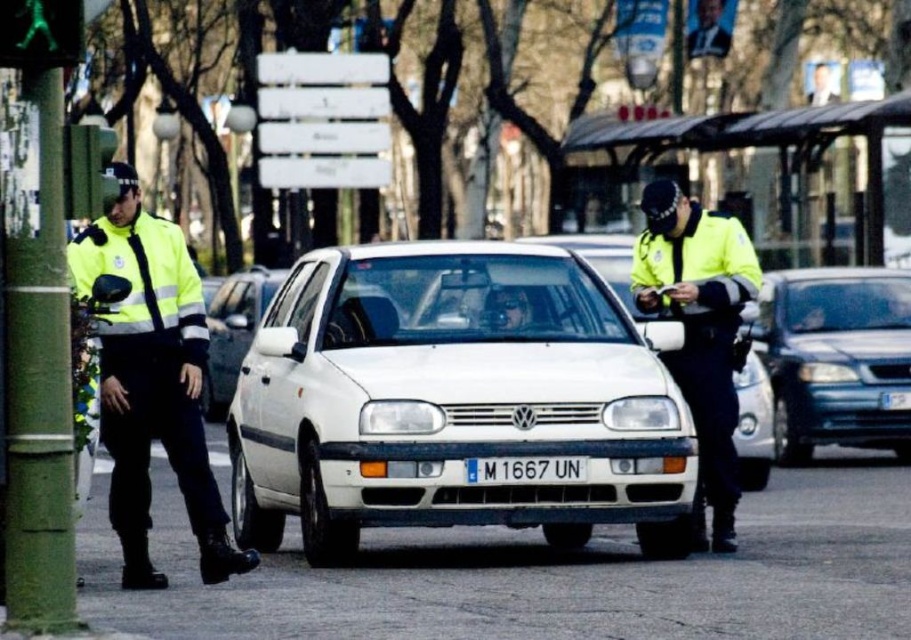
Does high visibility yellow jacket at center appear on the right side of white plastic license plate at center?

Correct, you'll find high visibility yellow jacket at center to the right of white plastic license plate at center.

The image size is (911, 640). Identify the location of high visibility yellow jacket at center. (699, 332).

Where is `high visibility yellow jacket at center`? high visibility yellow jacket at center is located at coordinates (699, 332).

Where is `high visibility yellow jacket at left`? Image resolution: width=911 pixels, height=640 pixels. high visibility yellow jacket at left is located at coordinates (152, 381).

Does high visibility yellow jacket at left appear over blue metallic sedan at right?

Actually, high visibility yellow jacket at left is below blue metallic sedan at right.

Looking at this image, who is more forward, (x=131, y=284) or (x=776, y=408)?

Point (x=131, y=284)

Locate an element on the screen. The image size is (911, 640). high visibility yellow jacket at left is located at coordinates (152, 381).

Is point (347, 464) farther from camera compared to point (733, 316)?

No, (347, 464) is in front of (733, 316).

From the picture: Does white matte hatchback at center have a smaller size compared to high visibility yellow jacket at center?

Incorrect, white matte hatchback at center is not smaller in size than high visibility yellow jacket at center.

Locate an element on the screen. white matte hatchback at center is located at coordinates (452, 401).

Image resolution: width=911 pixels, height=640 pixels. I want to click on white matte hatchback at center, so click(x=452, y=401).